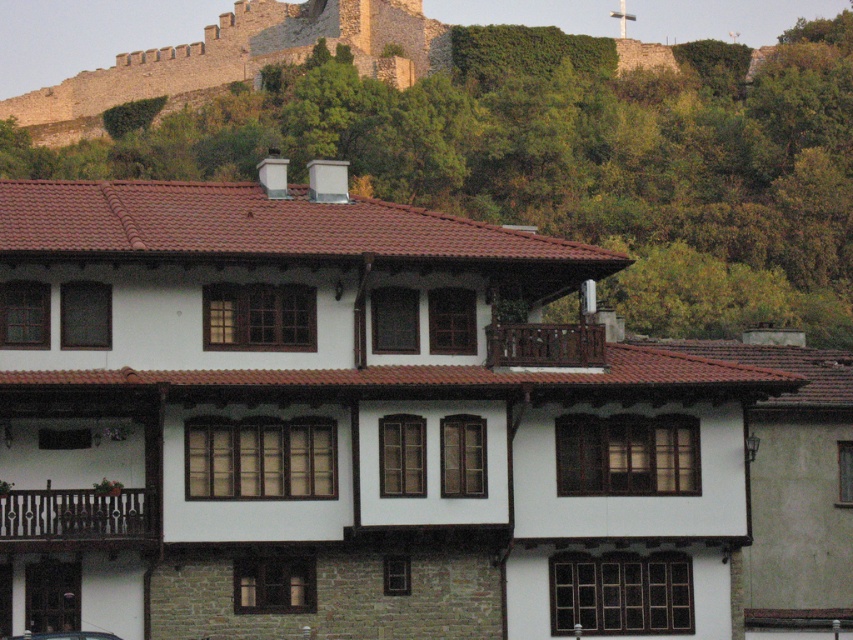
Image resolution: width=853 pixels, height=640 pixels. What do you see at coordinates (239, 60) in the screenshot?
I see `brown stone wall at upper center` at bounding box center [239, 60].

Is point (415, 13) behind point (55, 634)?

Yes, it is behind point (55, 634).

Find the location of a particular element. This screenshot has height=640, width=853. brown stone wall at upper center is located at coordinates (239, 60).